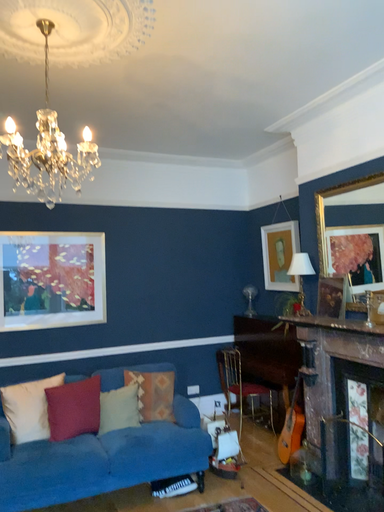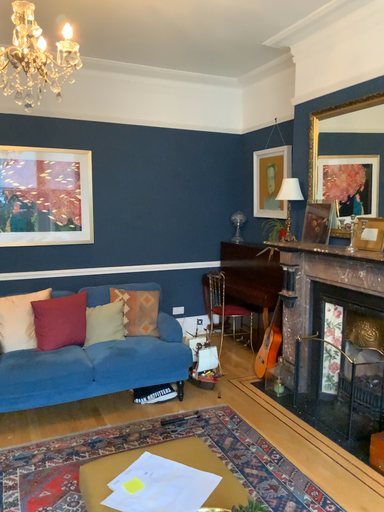
Question: Which way did the camera rotate in the video?

Choices:
 (A) rotated upward
 (B) rotated downward

Answer: (B)